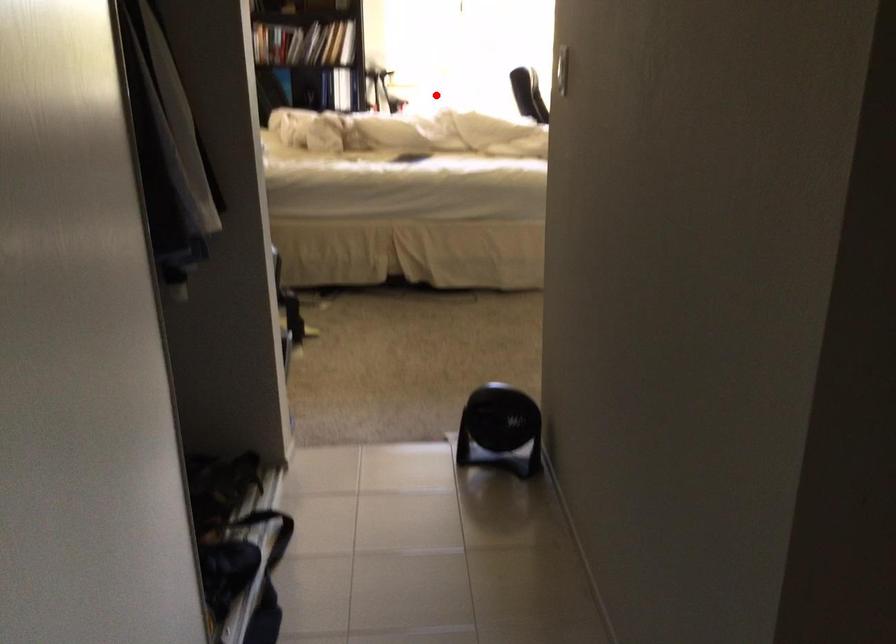
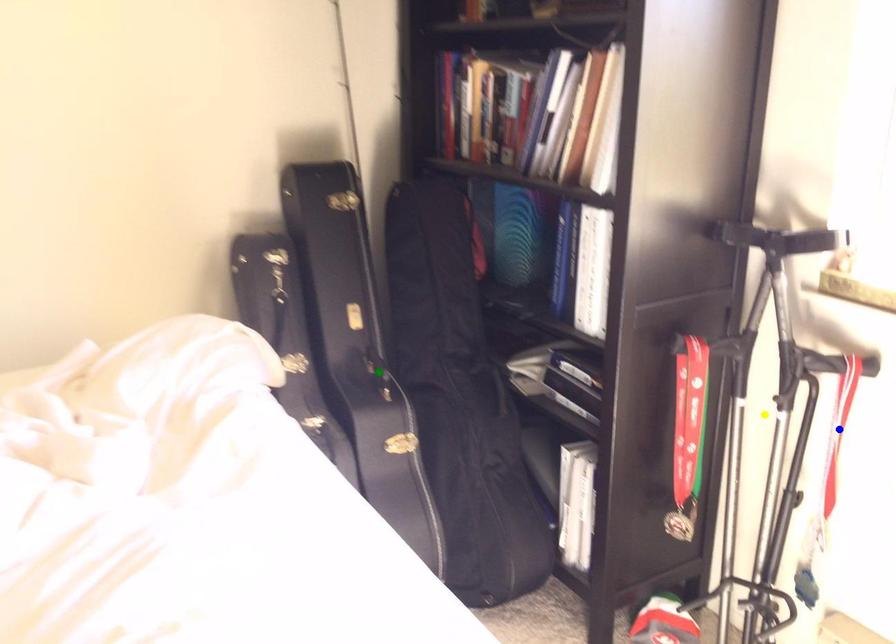
Question: I am providing you with two images of the same scene from different viewpoints. A red point is marked on the first image. You are given multiple points on the second image. Which point in image 2 is actually the same real-world point as the red point in image 1?

Choices:
 (A) green point
 (B) blue point
 (C) yellow point

Answer: (B)